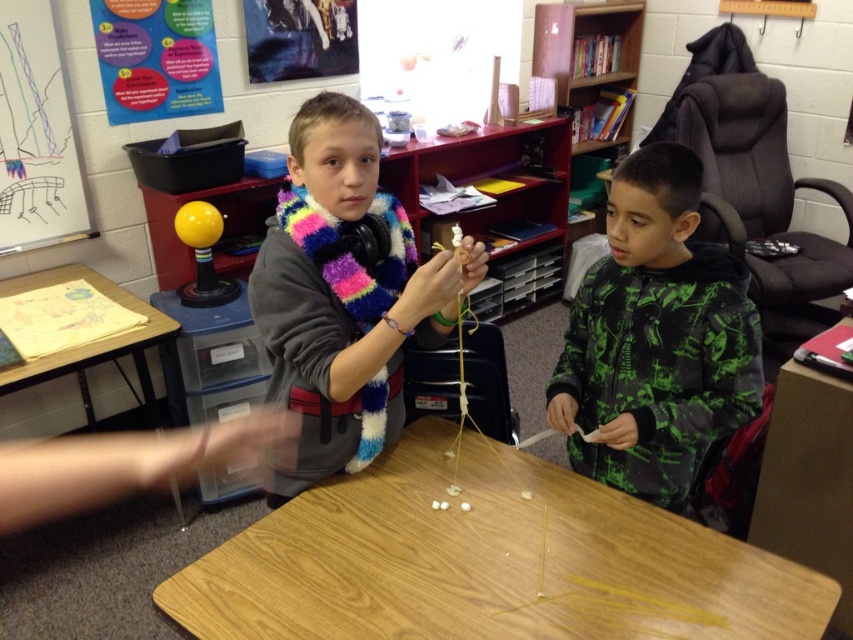
Based on the photo, you are a student in the classroom. You need to hang a small picture on the wall. Which object, the multicolored fuzzy scarf at center or the whiteboard at upper left, would be more suitable for temporarily pinning the picture?

The whiteboard at upper left is more suitable for temporarily pinning the picture because it is a surface typically used for hanging items, whereas the multicolored fuzzy scarf at center is an article of clothing and not meant for pinning.

You are a student in the classroom and want to place your notebook on the wooden table at center and the green camouflage hoodie at center. Which object can you place the notebook on?

The wooden table at center is larger in size than the green camouflage hoodie at center, so the notebook can be placed on the wooden table at center.

You are a student in the classroom. You need to hang a poster on the whiteboard at upper left and the wooden table at left. Which surface will allow you to hang the poster higher from the floor?

The whiteboard at upper left has a greater height compared to the wooden table at left, so you can hang the poster higher on the whiteboard at upper left.